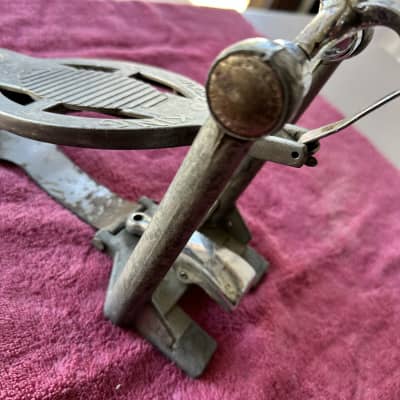
Locate an element on the screen. towel is located at coordinates (316, 216), (21, 338), (94, 19).